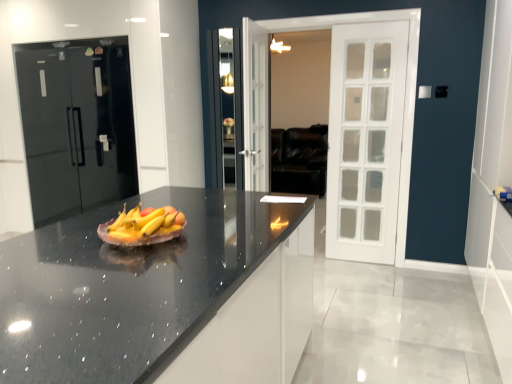
Question: From the image's perspective, is matte ceramic grapefruit at center located above or below black granite countertop at center?

Choices:
 (A) below
 (B) above

Answer: (B)

Question: Would you say matte ceramic grapefruit at center is to the left or to the right of black granite countertop at center in the picture?

Choices:
 (A) left
 (B) right

Answer: (A)

Question: Which object is positioned closest to the matte ceramic grapefruit at center?

Choices:
 (A) glossy black refrigerator at left
 (B) black granite countertop at center
 (C) white door at right

Answer: (B)

Question: Which object is the farthest from the white door at right?

Choices:
 (A) black granite countertop at center
 (B) glossy black refrigerator at left
 (C) matte ceramic grapefruit at center

Answer: (B)